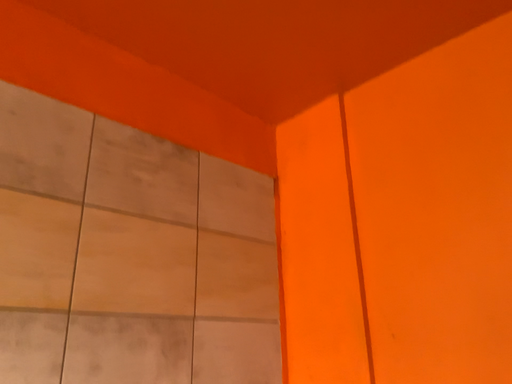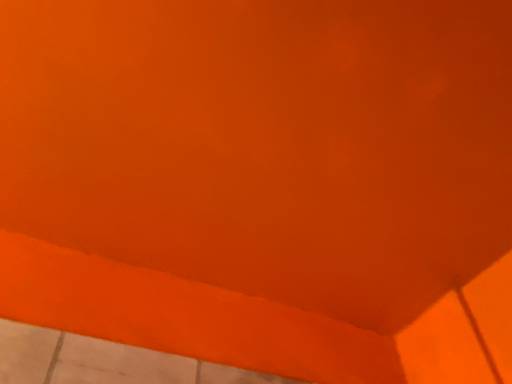
Question: Which way did the camera rotate in the video?

Choices:
 (A) rotated downward
 (B) rotated upward

Answer: (B)